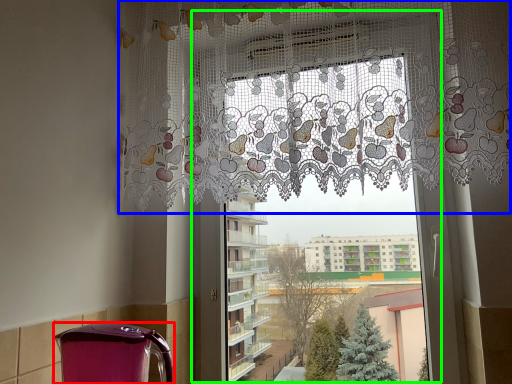
Question: Based on their relative distances, which object is farther from appliance (highlighted by a red box)? Choose from curtain (highlighted by a blue box) and window frame (highlighted by a green box).

Choices:
 (A) curtain
 (B) window frame

Answer: (A)